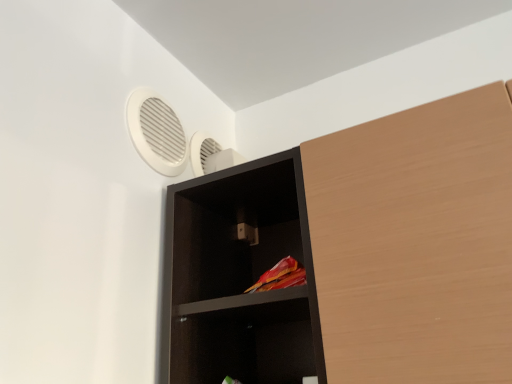
Question: Is white plastic fan at upper left taller or shorter than black matte shelf at center?

Choices:
 (A) tall
 (B) short

Answer: (B)

Question: Considering the positions of white plastic fan at upper left and black matte shelf at center in the image, is white plastic fan at upper left wider or thinner than black matte shelf at center?

Choices:
 (A) thin
 (B) wide

Answer: (A)

Question: In the image, is white plastic fan at upper left on the left side or the right side of black matte shelf at center?

Choices:
 (A) right
 (B) left

Answer: (B)

Question: In the image, is black matte shelf at center positioned in front of or behind white plastic fan at upper left?

Choices:
 (A) behind
 (B) front

Answer: (B)

Question: Which is correct: black matte shelf at center is inside white plastic fan at upper left, or outside of it?

Choices:
 (A) outside
 (B) inside

Answer: (A)

Question: Is point (164, 375) closer or farther from the camera than point (174, 165)?

Choices:
 (A) farther
 (B) closer

Answer: (B)

Question: From a real-world perspective, relative to white plastic fan at upper left, is black matte shelf at center vertically above or below?

Choices:
 (A) above
 (B) below

Answer: (B)